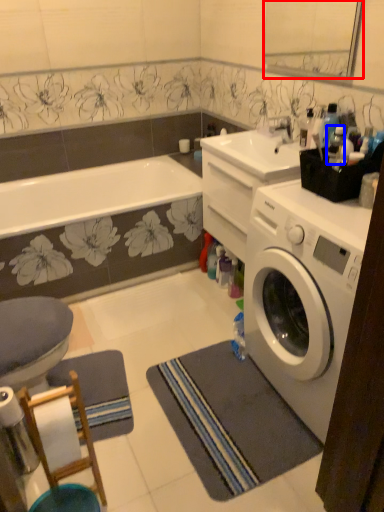
Question: Which of the following is the closest to the observer, mirror (highlighted by a red box) or bottle (highlighted by a blue box)?

Choices:
 (A) mirror
 (B) bottle

Answer: (B)